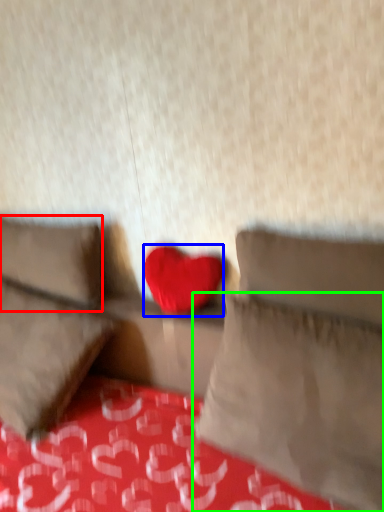
Question: Based on their relative distances, which object is nearer to pillow (highlighted by a red box)? Choose from heart (highlighted by a blue box) and pillow (highlighted by a green box).

Choices:
 (A) heart
 (B) pillow

Answer: (A)